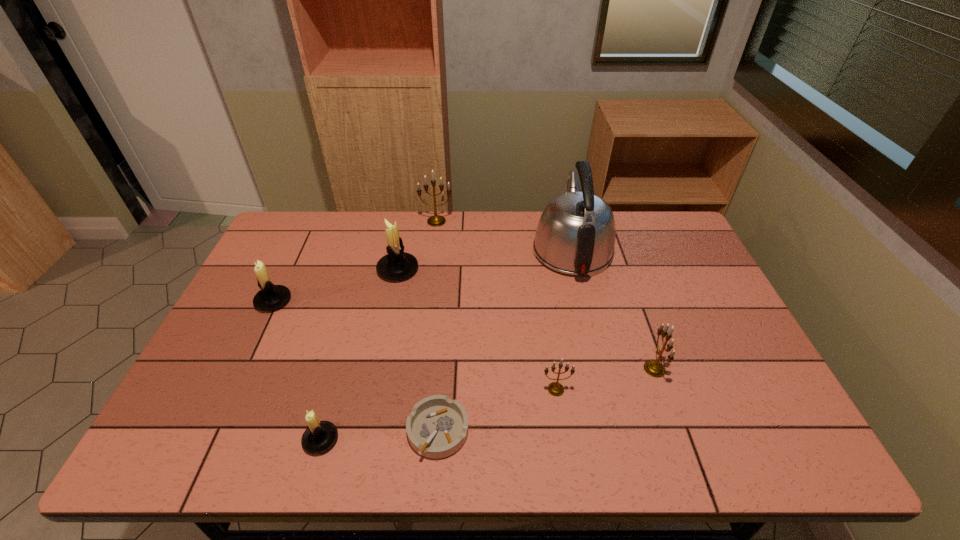
This screenshot has height=540, width=960. What are the coordinates of `vacant space that satisfies the following two spatial constraints: 1. on the back side of the second candle holder from right to left; 2. on the right side of the rightmost gold candelabrum` in the screenshot? It's located at (553, 369).

This screenshot has height=540, width=960. In order to click on free location that satisfies the following two spatial constraints: 1. on the back side of the smallest white candle holder; 2. on the left side of the second farthest candle holder in this screenshot , I will do `click(368, 269)`.